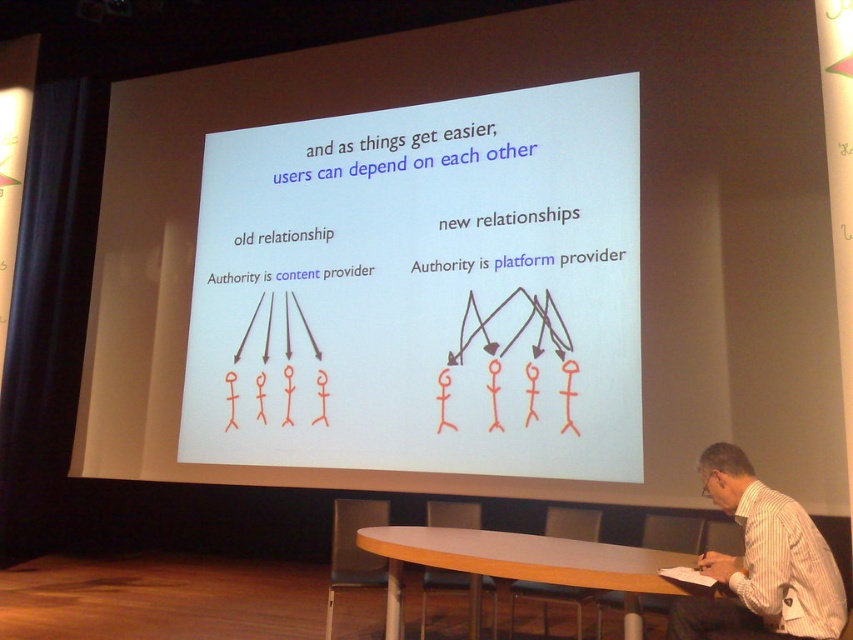
Question: Considering the real-world distances, which object is closest to the white paper at center?

Choices:
 (A) white striped shirt at lower right
 (B) light brown wooden table at center

Answer: (B)

Question: Considering the relative positions of white paper at center and light brown wooden table at center in the image provided, where is white paper at center located with respect to light brown wooden table at center?

Choices:
 (A) left
 (B) right

Answer: (A)

Question: Which point is closer to the camera?

Choices:
 (A) light brown wooden table at center
 (B) white paper at center

Answer: (A)

Question: Estimate the real-world distances between objects in this image. Which object is farther from the light brown wooden table at center?

Choices:
 (A) white paper at center
 (B) white striped shirt at lower right

Answer: (A)

Question: Is white striped shirt at lower right to the right of light brown wooden table at center from the viewer's perspective?

Choices:
 (A) yes
 (B) no

Answer: (A)

Question: From the image, what is the correct spatial relationship of white paper at center in relation to light brown wooden table at center?

Choices:
 (A) below
 (B) above

Answer: (B)